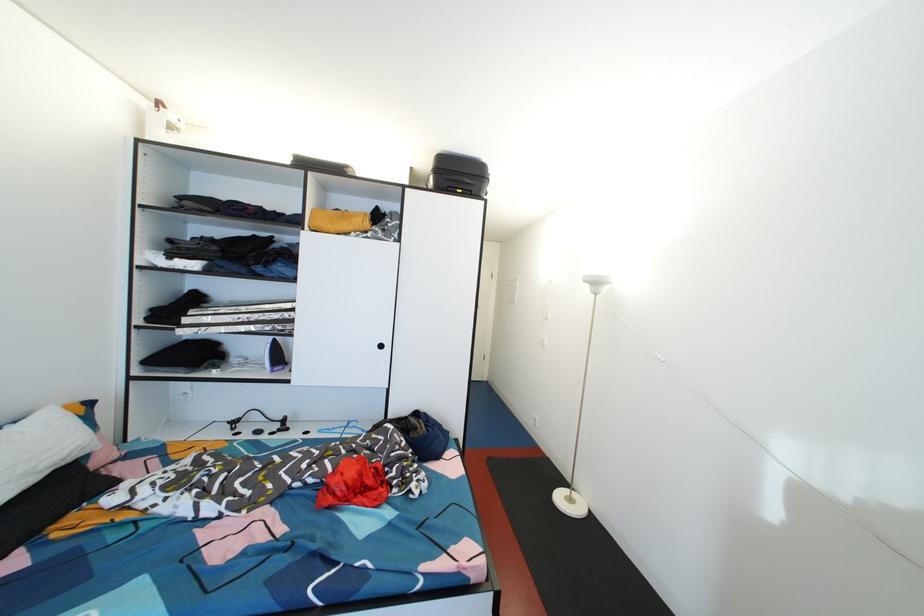
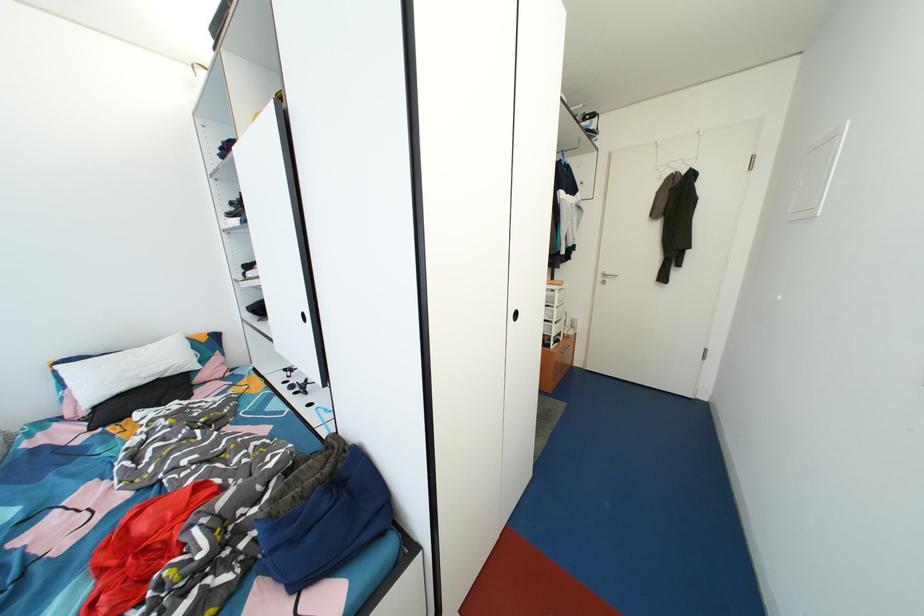
The point at (239, 434) is marked in the first image. Where is the corresponding point in the second image?

(295, 382)